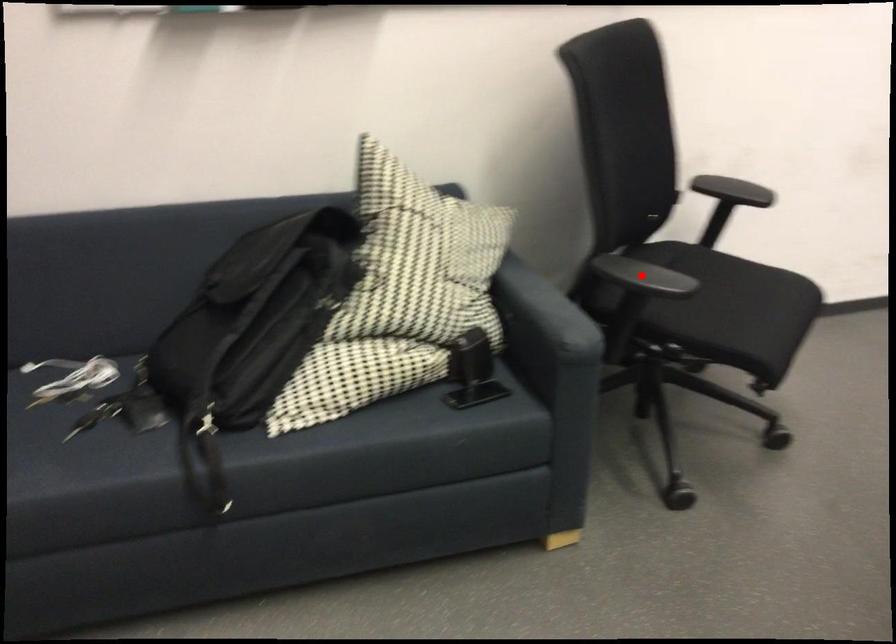
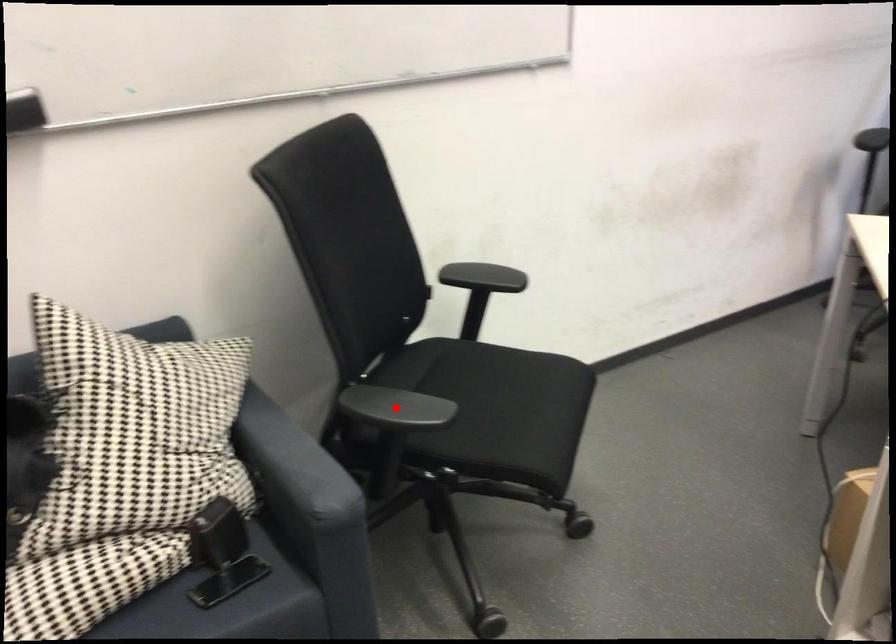
I am providing you with two images of the same scene from different viewpoints. A red point is marked on the first image and another point is marked on the second image. Does the point marked in image1 correspond to the same location as the one in image2?

Yes